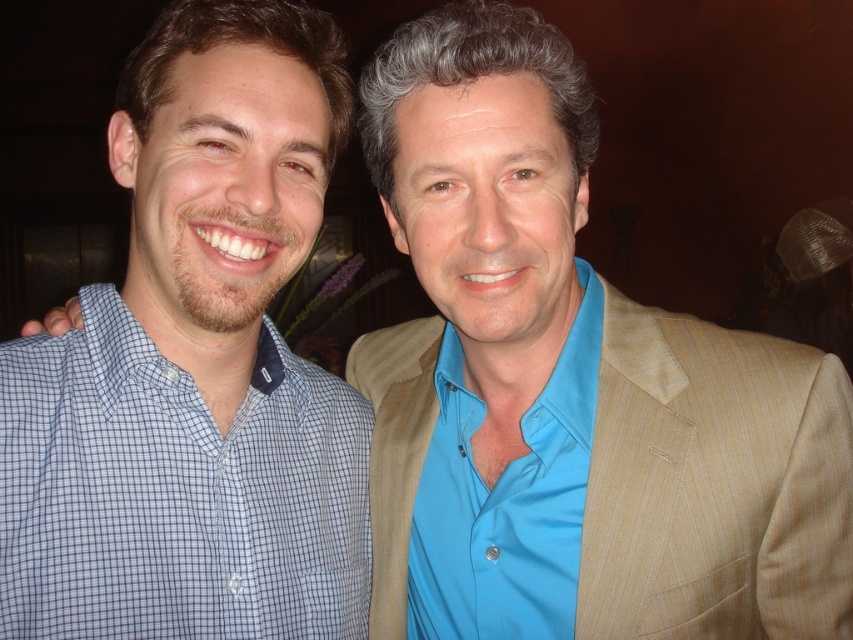
Is blue checkered shirt at left closer to the viewer compared to blue satin shirt at center?

Yes.

Between blue checkered shirt at left and blue satin shirt at center, which one is positioned higher?

blue satin shirt at center is above.

Which is behind, point (38, 410) or point (521, 516)?

Positioned behind is point (521, 516).

The image size is (853, 640). What are the coordinates of `blue checkered shirt at left` in the screenshot? It's located at (177, 492).